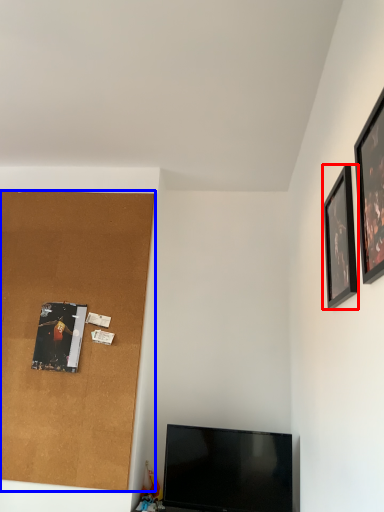
Question: Which object is closer to the camera taking this photo, picture frame (highlighted by a red box) or plywood (highlighted by a blue box)?

Choices:
 (A) picture frame
 (B) plywood

Answer: (A)